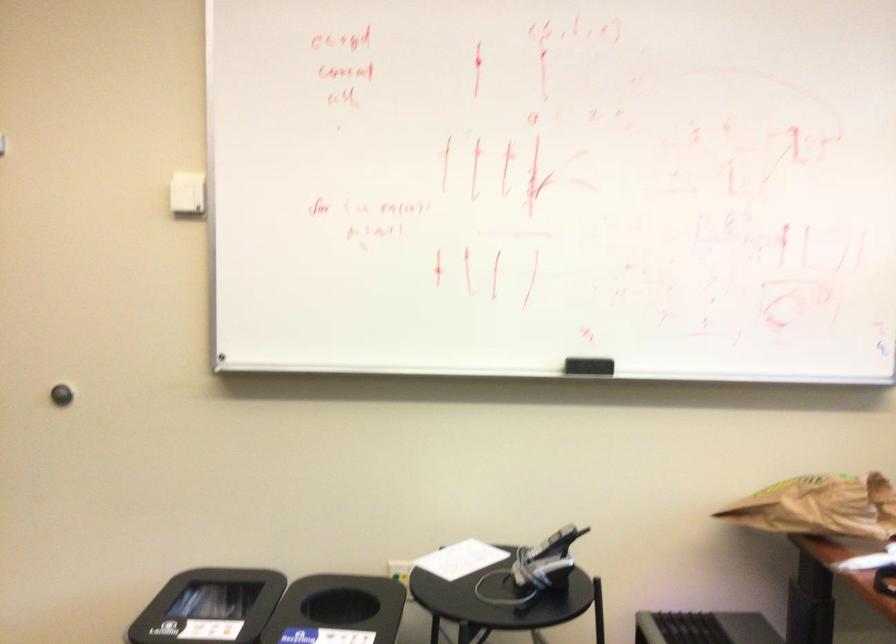
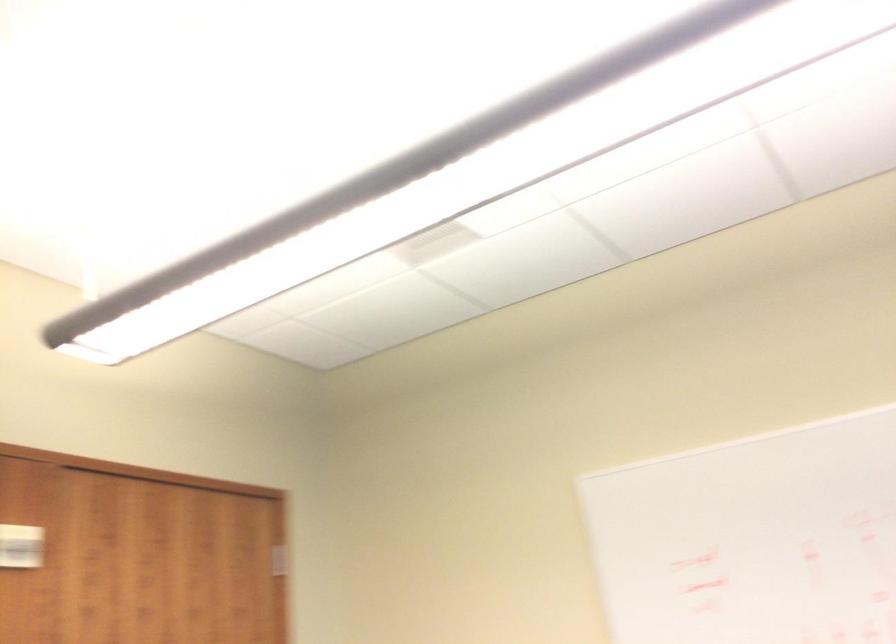
How did the camera likely rotate?

The camera rotated toward left-up.